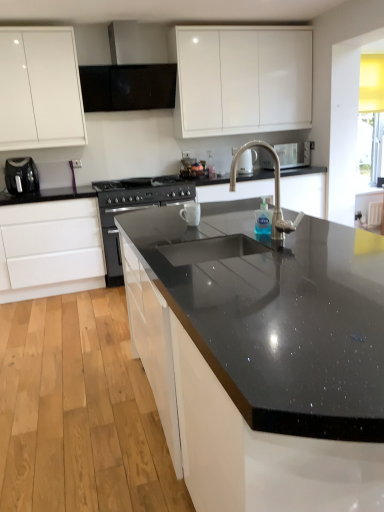
Question: Is the depth of white matte drawer at lower left, the 2th cabinetry when ordered from top to bottom, less than that of black matte exhaust hood at upper center?

Choices:
 (A) yes
 (B) no

Answer: (A)

Question: Does white matte drawer at lower left, marked as the 1th cabinetry in a bottom-to-top arrangement, appear on the left side of black matte exhaust hood at upper center?

Choices:
 (A) no
 (B) yes

Answer: (B)

Question: Is white matte drawer at lower left, the 2th cabinetry when ordered from top to bottom, further to the viewer compared to black matte exhaust hood at upper center?

Choices:
 (A) no
 (B) yes

Answer: (A)

Question: From the image's perspective, is white matte drawer at lower left, marked as the 1th cabinetry in a bottom-to-top arrangement, over black matte exhaust hood at upper center?

Choices:
 (A) no
 (B) yes

Answer: (A)

Question: Does white matte drawer at lower left, the 2th cabinetry when ordered from top to bottom, have a greater width compared to black matte exhaust hood at upper center?

Choices:
 (A) yes
 (B) no

Answer: (A)

Question: Can you confirm if white matte drawer at lower left, marked as the 1th cabinetry in a bottom-to-top arrangement, is bigger than black matte exhaust hood at upper center?

Choices:
 (A) yes
 (B) no

Answer: (A)

Question: Is black granite sink at center shorter than polished stainless steel faucet at center?

Choices:
 (A) no
 (B) yes

Answer: (A)

Question: Is black granite sink at center smaller than polished stainless steel faucet at center?

Choices:
 (A) no
 (B) yes

Answer: (A)

Question: Is black granite sink at center aimed at polished stainless steel faucet at center?

Choices:
 (A) no
 (B) yes

Answer: (B)

Question: Considering the relative positions of black granite sink at center and polished stainless steel faucet at center in the image provided, is black granite sink at center to the right of polished stainless steel faucet at center from the viewer's perspective?

Choices:
 (A) yes
 (B) no

Answer: (A)

Question: Considering the relative sizes of black granite sink at center and polished stainless steel faucet at center in the image provided, is black granite sink at center wider than polished stainless steel faucet at center?

Choices:
 (A) no
 (B) yes

Answer: (B)

Question: Considering the relative sizes of black granite sink at center and polished stainless steel faucet at center in the image provided, is black granite sink at center thinner than polished stainless steel faucet at center?

Choices:
 (A) no
 (B) yes

Answer: (A)

Question: From the image's perspective, does black granite sink at center appear higher than black matte exhaust hood at upper center?

Choices:
 (A) yes
 (B) no

Answer: (B)